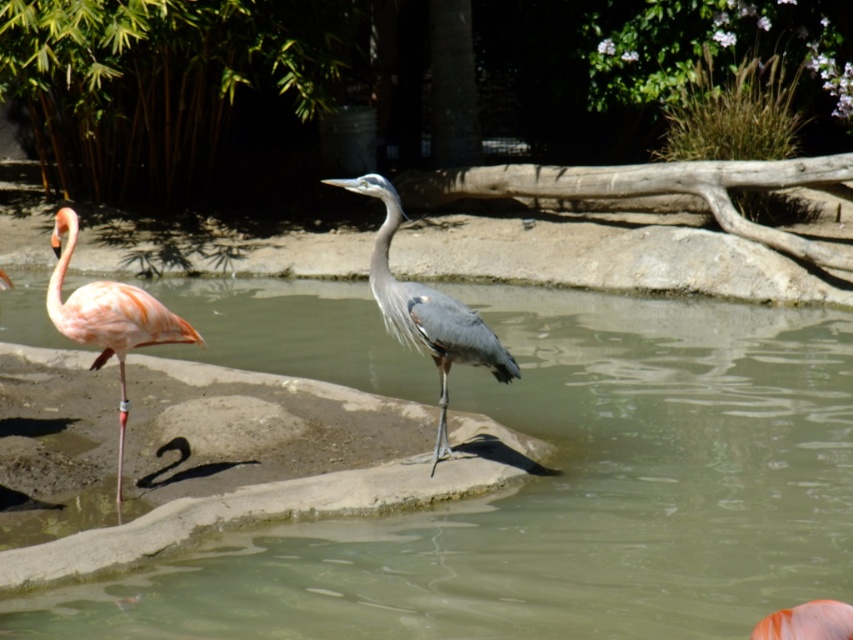
Is gray matte heron at center thinner than pink feathered flamingo at left?

In fact, gray matte heron at center might be wider than pink feathered flamingo at left.

Which is behind, point (380, 195) or point (67, 243)?

Positioned behind is point (67, 243).

Is point (386, 275) positioned after point (122, 336)?

Yes, point (386, 275) is farther from viewer.

You are a GUI agent. You are given a task and a screenshot of the screen. Output one action in this format:
    pyautogui.click(x=<x>, y=<y>)
    Task: Click on the gray matte heron at center
    
    Given the screenshot: What is the action you would take?
    pyautogui.click(x=426, y=310)

Between greenish water at center and pink feathered flamingo at left, which one appears on the left side from the viewer's perspective?

pink feathered flamingo at left is more to the left.

Who is taller, greenish water at center or pink feathered flamingo at left?

greenish water at center

Is point (816, 544) less distant than point (135, 300)?

No, (816, 544) is behind (135, 300).

You are a GUI agent. You are given a task and a screenshot of the screen. Output one action in this format:
    pyautogui.click(x=<x>, y=<y>)
    Task: Click on the greenish water at center
    The height and width of the screenshot is (640, 853).
    Given the screenshot: What is the action you would take?
    pyautogui.click(x=563, y=497)

Does greenish water at center appear on the right side of gray matte heron at center?

Indeed, greenish water at center is positioned on the right side of gray matte heron at center.

Is greenish water at center positioned at the back of gray matte heron at center?

No.

What do you see at coordinates (563, 497) in the screenshot?
I see `greenish water at center` at bounding box center [563, 497].

Locate an element on the screen. Image resolution: width=853 pixels, height=640 pixels. greenish water at center is located at coordinates (x=563, y=497).